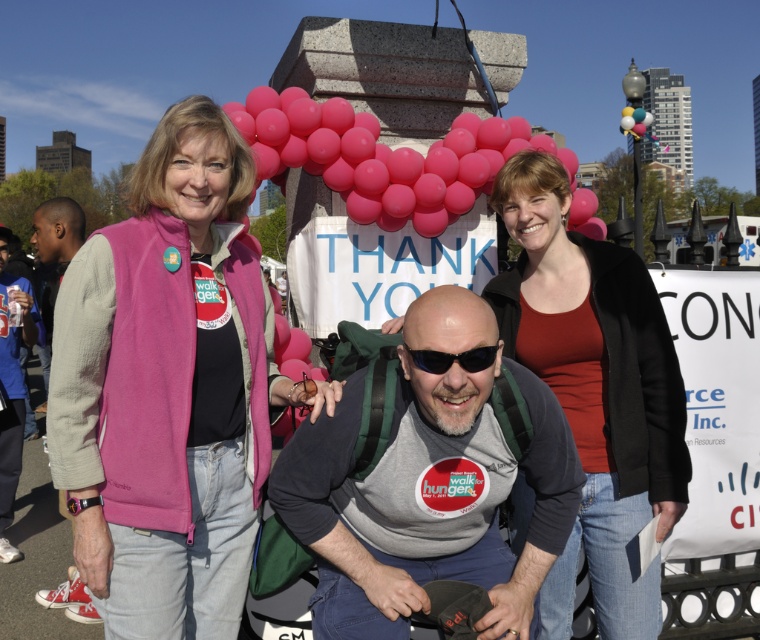
Based on the scene description, which participant is taller between the person wearing the pink fleece vest at left and the one in the gray fabric shirt at center?

The pink fleece vest at left is much taller than the gray fabric shirt at center.

Based on the scene description, where is the pink fleece vest at left located in terms of coordinates?

The pink fleece vest at left is located at point [171,388].

You are a photographer at the event and want to capture both the gray fabric shirt at center and the black plastic sunglasses at center in a single frame. Which object should you focus on to ensure both are in the frame without moving the camera?

The gray fabric shirt at center is wider than the black plastic sunglasses at center, so focusing on the gray fabric shirt at center would ensure both are in the frame since it occupies more space.